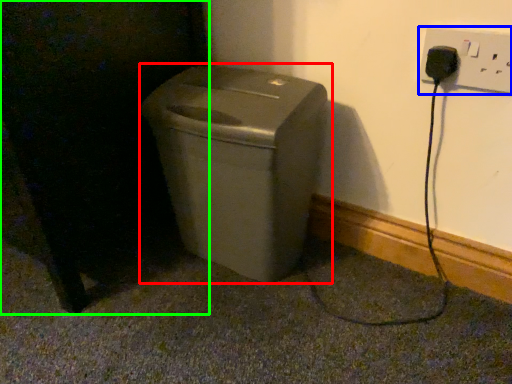
Question: Considering the real-world distances, which object is closest to waste container (highlighted by a red box)? electric outlet (highlighted by a blue box) or dark (highlighted by a green box).

Choices:
 (A) electric outlet
 (B) dark

Answer: (B)